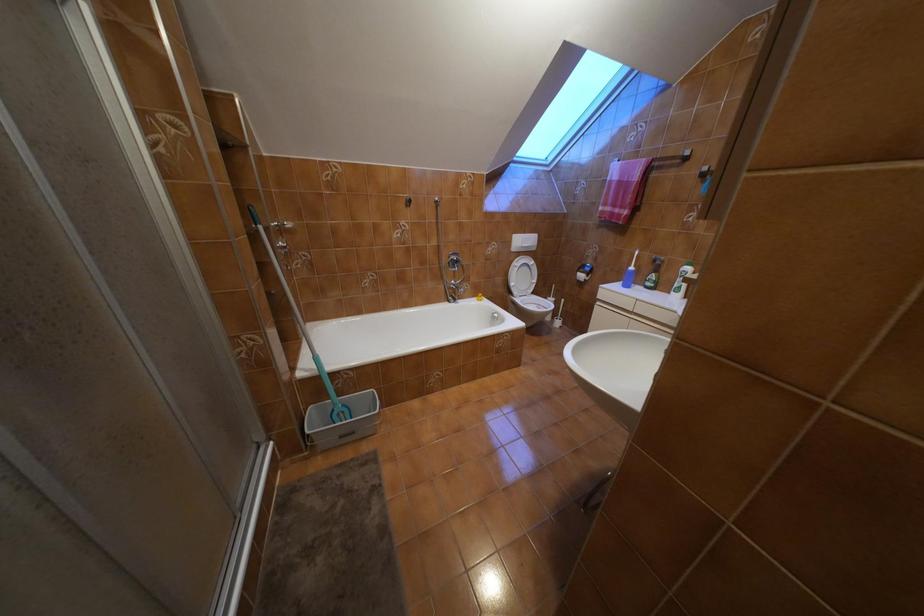
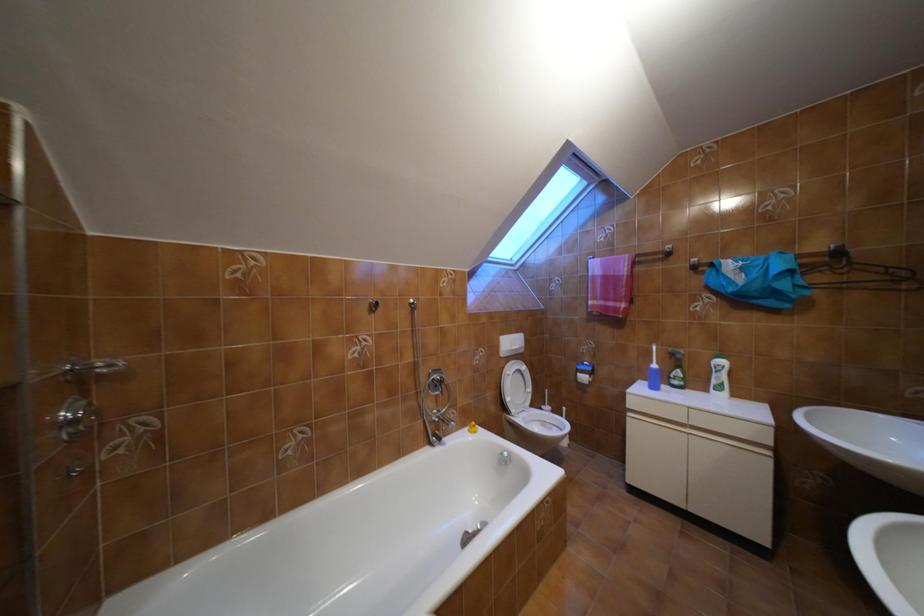
How did the camera likely rotate?

The camera rotated toward right-up.